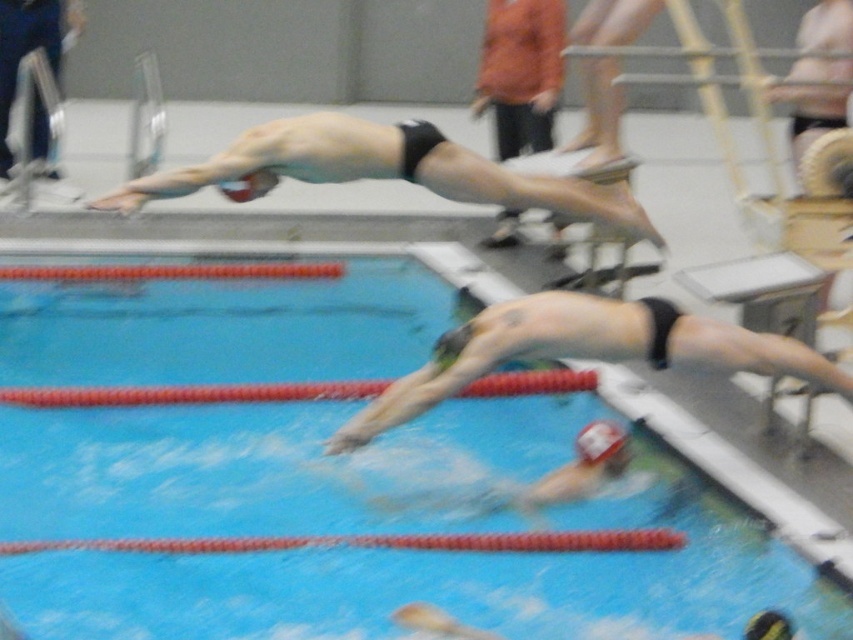
You are a spectator at the poolside and want to take a photo of the black matte swim cap at center and the black matte swim cap at upper center. Which swim cap will appear larger in your photo?

The black matte swim cap at center will appear larger in the photo because it is closer to the viewer than the black matte swim cap at upper center.